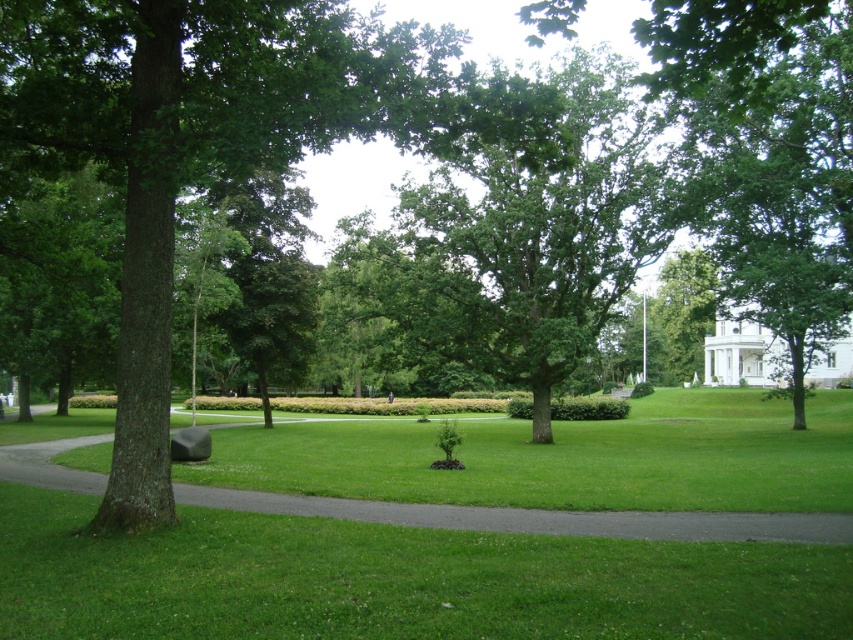
You are standing at the entrance of the park and see the point marked at coordinates (520, 227). Based on the scene description, what object does this point most likely represent?

The point at coordinates (520, 227) corresponds to the green leafy tree at center, as stated in the object description.

You are standing on the green grass at lower center and want to walk towards the green leafy tree at center. Which direction should you head?

Since the green leafy tree at center is to the right of green grass at lower center, you should head to the right to reach it.